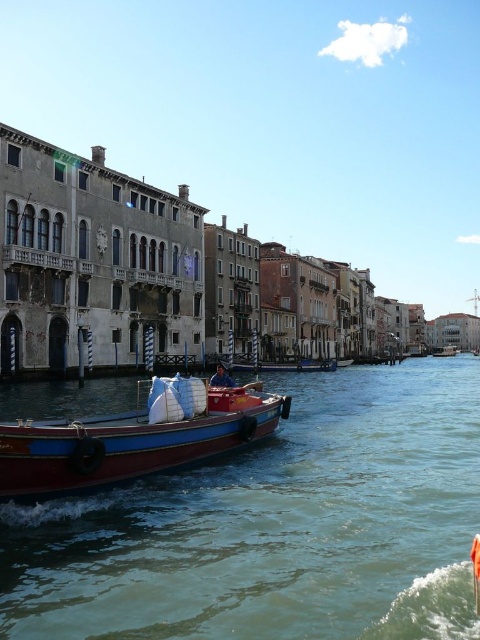
Is wooden boat at center below wooden boat at right?

Actually, wooden boat at center is above wooden boat at right.

Between wooden boat at center and wooden boat at right, which one has less height?

With less height is wooden boat at right.

I want to click on wooden boat at center, so click(x=133, y=440).

Identify the location of wooden boat at center. Image resolution: width=480 pixels, height=640 pixels. (133, 440).

Is greenish-blue water at center taller than wooden boat at center?

Correct, greenish-blue water at center is much taller as wooden boat at center.

Between greenish-blue water at center and wooden boat at center, which one is positioned lower?

greenish-blue water at center

You are a GUI agent. You are given a task and a screenshot of the screen. Output one action in this format:
    pyautogui.click(x=<x>, y=<y>)
    Task: Click on the greenish-blue water at center
    The width and height of the screenshot is (480, 640).
    Given the screenshot: What is the action you would take?
    pyautogui.click(x=275, y=525)

Find the location of `greenish-blue water at center`. greenish-blue water at center is located at coordinates (275, 525).

Can you confirm if greenish-blue water at center is positioned to the left of wooden boat at right?

Indeed, greenish-blue water at center is positioned on the left side of wooden boat at right.

Does point (243, 593) come behind point (452, 353)?

No, (243, 593) is closer to viewer.

I want to click on greenish-blue water at center, so click(x=275, y=525).

Find the location of a particular element. greenish-blue water at center is located at coordinates point(275,525).